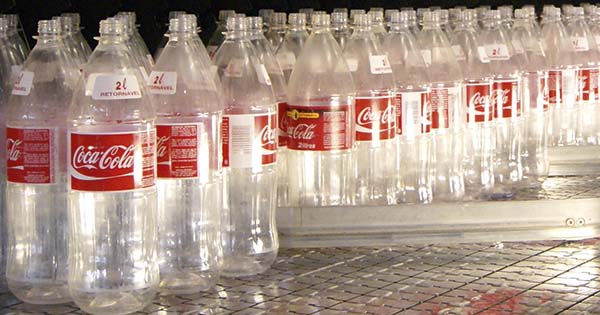
I want to click on divider, so click(x=359, y=217).